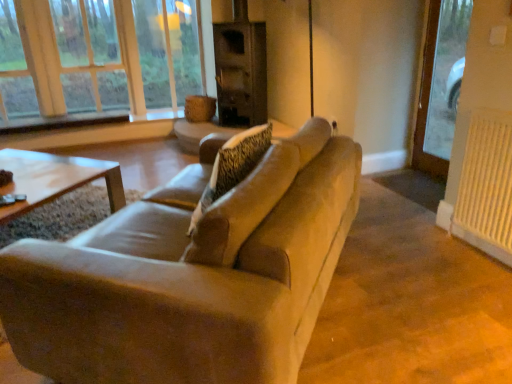
Describe the element at coordinates (100, 59) in the screenshot. I see `wooden frame at upper left` at that location.

Describe the element at coordinates (191, 275) in the screenshot. I see `beige fabric couch at center` at that location.

Where is `dark brown wood fireplace at center`? dark brown wood fireplace at center is located at coordinates (241, 69).

The height and width of the screenshot is (384, 512). What are the coordinates of `wooden frame at upper left` in the screenshot? It's located at (100, 59).

Is white textured radiator at right taller than dark brown wood fireplace at center?

Incorrect, the height of white textured radiator at right is not larger of that of dark brown wood fireplace at center.

Is white textured radiator at right located outside dark brown wood fireplace at center?

That's correct, white textured radiator at right is outside of dark brown wood fireplace at center.

From the image's perspective, is wooden frame at upper left below beige fabric couch at center?

No.

Considering the positions of points (39, 101) and (279, 191), is point (39, 101) closer to camera compared to point (279, 191)?

No, (39, 101) is behind (279, 191).

From a real-world perspective, is wooden frame at upper left positioned under beige fabric couch at center based on gravity?

Actually, wooden frame at upper left is physically above beige fabric couch at center in the real world.

Considering the sizes of objects wooden frame at upper left and beige fabric couch at center in the image provided, who is bigger, wooden frame at upper left or beige fabric couch at center?

beige fabric couch at center is bigger.

Based on the photo, is white textured radiator at right in contact with beige fabric couch at center?

A: white textured radiator at right and beige fabric couch at center are not in contact.

In the image, is white textured radiator at right on the left side or the right side of beige fabric couch at center?

In the image, white textured radiator at right appears on the right side of beige fabric couch at center.

From a real-world perspective, is white textured radiator at right on top of beige fabric couch at center?

Incorrect, from a real-world perspective, white textured radiator at right is lower than beige fabric couch at center.

Can you confirm if white textured radiator at right is bigger than beige fabric couch at center?

Incorrect, white textured radiator at right is not larger than beige fabric couch at center.

Is dark brown wood fireplace at center to the left or to the right of beige fabric couch at center in the image?

In the image, dark brown wood fireplace at center appears on the right side of beige fabric couch at center.

Measure the distance from dark brown wood fireplace at center to beige fabric couch at center.

The distance of dark brown wood fireplace at center from beige fabric couch at center is 9.42 feet.

How many degrees apart are the facing directions of dark brown wood fireplace at center and beige fabric couch at center?

The angle between the facing direction of dark brown wood fireplace at center and the facing direction of beige fabric couch at center is 132 degrees.

This screenshot has height=384, width=512. In order to click on studio couch in front of the dark brown wood fireplace at center in this screenshot , I will do `click(191, 275)`.

Locate an element on the screen. The width and height of the screenshot is (512, 384). fireplace lying above the white textured radiator at right (from the image's perspective) is located at coordinates (241, 69).

From the picture: Is dark brown wood fireplace at center facing towards white textured radiator at right?

Yes, dark brown wood fireplace at center is facing white textured radiator at right.

From the picture: Does dark brown wood fireplace at center have a lesser width compared to white textured radiator at right?

In fact, dark brown wood fireplace at center might be wider than white textured radiator at right.

Considering the relative sizes of wooden frame at upper left and dark brown wood fireplace at center in the image provided, is wooden frame at upper left bigger than dark brown wood fireplace at center?

Correct, wooden frame at upper left is larger in size than dark brown wood fireplace at center.

Looking at this image, is wooden frame at upper left taller or shorter than dark brown wood fireplace at center?

Result: Clearly, wooden frame at upper left is taller compared to dark brown wood fireplace at center.

From a real-world perspective, relative to dark brown wood fireplace at center, is wooden frame at upper left vertically above or below?

wooden frame at upper left is above dark brown wood fireplace at center.

Are beige fabric couch at center and white textured radiator at right making contact?

There is a gap between beige fabric couch at center and white textured radiator at right.

From their relative heights in the image, would you say beige fabric couch at center is taller or shorter than white textured radiator at right?

In the image, beige fabric couch at center appears to be shorter than white textured radiator at right.

In the scene shown: Between beige fabric couch at center and white textured radiator at right, which one appears on the right side from the viewer's perspective?

From the viewer's perspective, white textured radiator at right appears more on the right side.

Locate an element on the screen. Image resolution: width=512 pixels, height=384 pixels. radiator below the dark brown wood fireplace at center (from the image's perspective) is located at coordinates (486, 185).

This screenshot has height=384, width=512. Find the location of `window that is on the left side of beige fabric couch at center`. window that is on the left side of beige fabric couch at center is located at coordinates (100, 59).

Which object lies nearer to the anchor point dark brown wood fireplace at center, beige fabric couch at center or wooden frame at upper left?

wooden frame at upper left is positioned closer to the anchor dark brown wood fireplace at center.

Estimate the real-world distances between objects in this image. Which object is further from white textured radiator at right, wooden frame at upper left or dark brown wood fireplace at center?

wooden frame at upper left.

From the image, which object appears to be farther from wooden frame at upper left, dark brown wood fireplace at center or white textured radiator at right?

Based on the image, white textured radiator at right appears to be further to wooden frame at upper left.

Looking at the image, which one is located closer to wooden frame at upper left, beige fabric couch at center or white textured radiator at right?

beige fabric couch at center lies closer to wooden frame at upper left than the other object.

From the image, which object appears to be farther from dark brown wood fireplace at center, white textured radiator at right or wooden frame at upper left?

Based on the image, white textured radiator at right appears to be further to dark brown wood fireplace at center.

Which object lies further to the anchor point wooden frame at upper left, white textured radiator at right or dark brown wood fireplace at center?

white textured radiator at right.

From the image, which object appears to be nearer to white textured radiator at right, beige fabric couch at center or wooden frame at upper left?

The object closer to white textured radiator at right is beige fabric couch at center.

Estimate the real-world distances between objects in this image. Which object is closer to beige fabric couch at center, dark brown wood fireplace at center or white textured radiator at right?

white textured radiator at right.

I want to click on fireplace between beige fabric couch at center and wooden frame at upper left in the front-back direction, so click(x=241, y=69).

Where is `radiator between beige fabric couch at center and wooden frame at upper left in the front-back direction`? This screenshot has width=512, height=384. radiator between beige fabric couch at center and wooden frame at upper left in the front-back direction is located at coordinates (486, 185).

This screenshot has height=384, width=512. Find the location of `fireplace located between wooden frame at upper left and white textured radiator at right in the left-right direction`. fireplace located between wooden frame at upper left and white textured radiator at right in the left-right direction is located at coordinates (241, 69).

I want to click on radiator between beige fabric couch at center and dark brown wood fireplace at center from front to back, so click(486, 185).